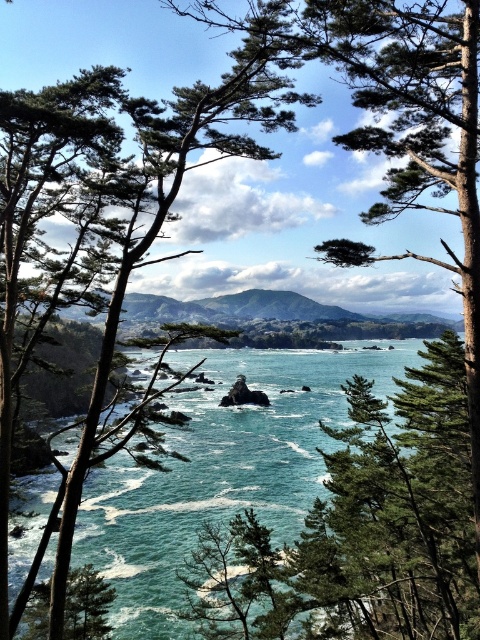
You are standing at the center of the image and want to walk towards the teal glossy water at center. In which direction should you move?

Since the teal glossy water at center is located at point 0.738 on the x axis and 0.460 on the y axis, you should move towards the right and slightly downward to reach it.

You are standing at the edge of the coastal landscape and want to walk towards the teal glossy water at center. However, there is a green leafy tree at center in your path. Based on the scene description, can you walk straight ahead without going around the tree?

The teal glossy water at center is further to the viewer than green leafy tree at center, so the tree is closer to you. Therefore, walking straight ahead would require going around the green leafy tree at center to reach the teal glossy water at center.

You are standing in the coastal landscape and want to walk from the green leafy tree at center to the teal glossy water at center. Which direction should you head?

You should head to the right because the teal glossy water at center is located to the right of the green leafy tree at center.